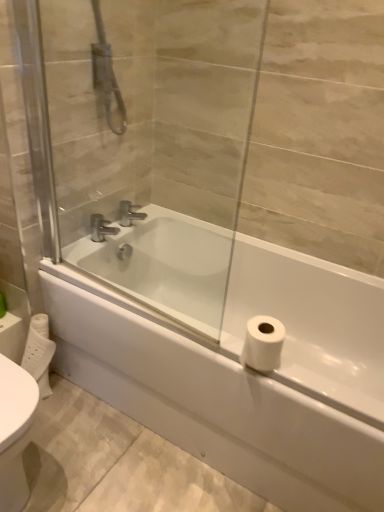
Question: Is chrome metallic faucet at upper center, which appears as the second tap when viewed from the left, positioned with its back to white glossy bathtub at center?

Choices:
 (A) yes
 (B) no

Answer: (B)

Question: Does chrome metallic faucet at upper center, which is the first tap from right to left, have a larger size compared to white glossy bathtub at center?

Choices:
 (A) yes
 (B) no

Answer: (B)

Question: Can you confirm if chrome metallic faucet at upper center, which is the first tap from right to left, is shorter than white glossy bathtub at center?

Choices:
 (A) yes
 (B) no

Answer: (A)

Question: Is chrome metallic faucet at upper center, which appears as the second tap when viewed from the left, thinner than white glossy bathtub at center?

Choices:
 (A) yes
 (B) no

Answer: (A)

Question: Considering the relative positions of chrome metallic faucet at upper center, which is the first tap from right to left, and white glossy bathtub at center in the image provided, is chrome metallic faucet at upper center, which is the first tap from right to left, to the left of white glossy bathtub at center from the viewer's perspective?

Choices:
 (A) yes
 (B) no

Answer: (A)

Question: Is transparent glass screen door at upper center taller or shorter than silver metallic faucet at center, the 2th tap from the right?

Choices:
 (A) tall
 (B) short

Answer: (A)

Question: Considering the positions of point (162, 266) and point (99, 241), is point (162, 266) closer or farther from the camera than point (99, 241)?

Choices:
 (A) closer
 (B) farther

Answer: (B)

Question: From the image's perspective, is transparent glass screen door at upper center positioned above or below silver metallic faucet at center, marked as the 1th tap in a left-to-right arrangement?

Choices:
 (A) below
 (B) above

Answer: (B)

Question: Do you think transparent glass screen door at upper center is within silver metallic faucet at center, the 2th tap from the right, or outside of it?

Choices:
 (A) inside
 (B) outside

Answer: (B)

Question: Which is correct: silver metallic faucet at center, marked as the 1th tap in a left-to-right arrangement, is inside transparent glass screen door at upper center, or outside of it?

Choices:
 (A) outside
 (B) inside

Answer: (A)

Question: Is silver metallic faucet at center, the 2th tap from the right, to the left or to the right of transparent glass screen door at upper center in the image?

Choices:
 (A) right
 (B) left

Answer: (B)

Question: From a real-world perspective, is silver metallic faucet at center, marked as the 1th tap in a left-to-right arrangement, above or below transparent glass screen door at upper center?

Choices:
 (A) below
 (B) above

Answer: (A)

Question: In terms of size, does silver metallic faucet at center, the 2th tap from the right, appear bigger or smaller than transparent glass screen door at upper center?

Choices:
 (A) big
 (B) small

Answer: (B)

Question: From the image's perspective, is transparent glass screen door at upper center located above or below chrome metallic faucet at upper center, which is the first tap from right to left?

Choices:
 (A) below
 (B) above

Answer: (B)

Question: Is transparent glass screen door at upper center in front of or behind chrome metallic faucet at upper center, which is the first tap from right to left, in the image?

Choices:
 (A) behind
 (B) front

Answer: (B)